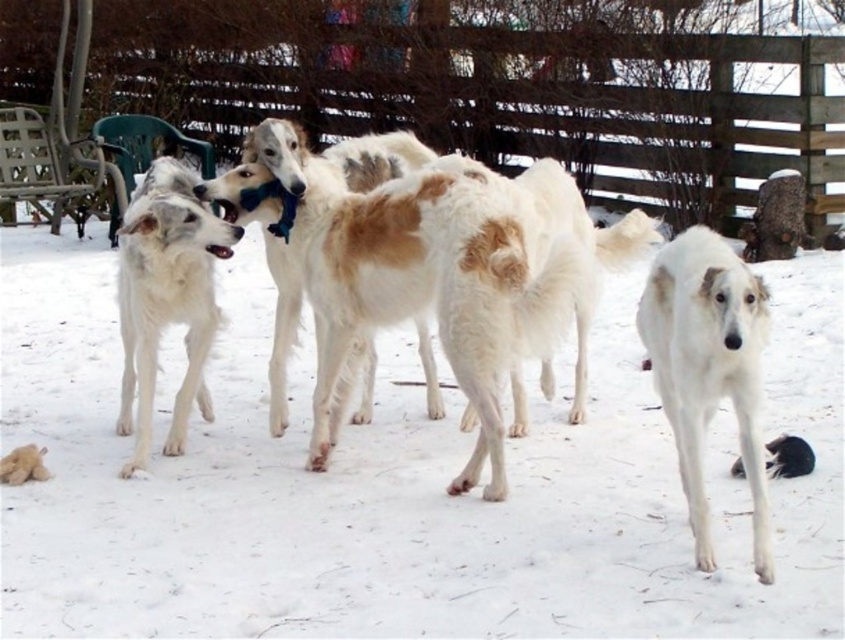
You are a photographer trying to capture a photo of the wooden fence at upper center and the white fluffy dog at lower right. Based on their heights, which one should you focus on first if you want to ensure both are fully in frame without cropping?

The wooden fence at upper center is not as tall as the white fluffy dog at lower right, so you should focus on the white fluffy dog at lower right first to ensure it fits entirely in the frame before adjusting for the shorter wooden fence at upper center.

You are standing in the snowy field and want to take a photo of the wooden fence at upper center and the white fur dog at left. Can you fit both in the frame without moving the camera?

The wooden fence at upper center is above the white fur dog at left, so they are positioned vertically apart. Since the camera frame can capture both vertical and horizontal spaces, you can likely include both in the photo by adjusting the zoom or framing angle to encompass their positions.